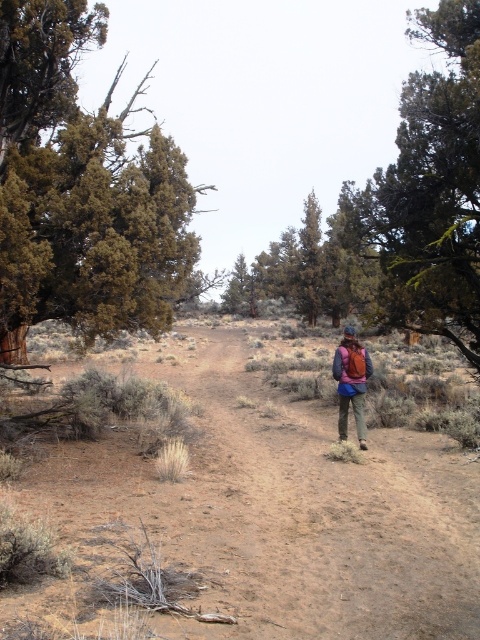
You are a hiker on a dirt path in an arid area. You notice two trees ahead of you, a green textured tree at right and a green textured tree at center. Which tree is taller?

The green textured tree at right is taller than the green textured tree at center.

From the picture: You are a hiker standing on a dirt path in an arid area with scattered coniferous trees. You see a point marked at coordinates point (266, 428). Can you estimate how far this point is from your current position?

The point (266, 428) is 37.91 feet away from the viewer, so the distance is approximately 37.91 feet.